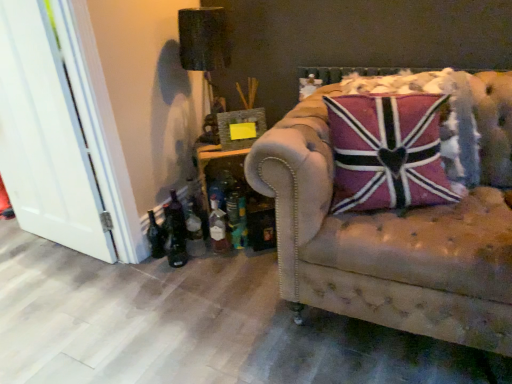
What are the coordinates of `vacant area that is in front of translucent glass bottle at lower left, the 2th bottle in the left-to-right sequence` in the screenshot? It's located at (196, 273).